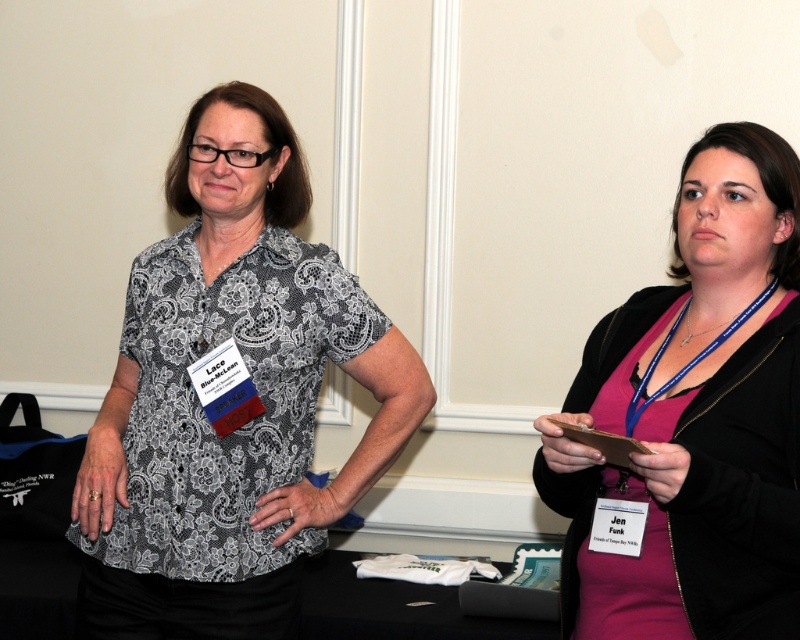
Does lace fabric blouse at center appear under pink fabric dress at right?

No, lace fabric blouse at center is not below pink fabric dress at right.

Does lace fabric blouse at center have a greater width compared to pink fabric dress at right?

Indeed, lace fabric blouse at center has a greater width compared to pink fabric dress at right.

Find the location of a particular element. lace fabric blouse at center is located at coordinates (237, 406).